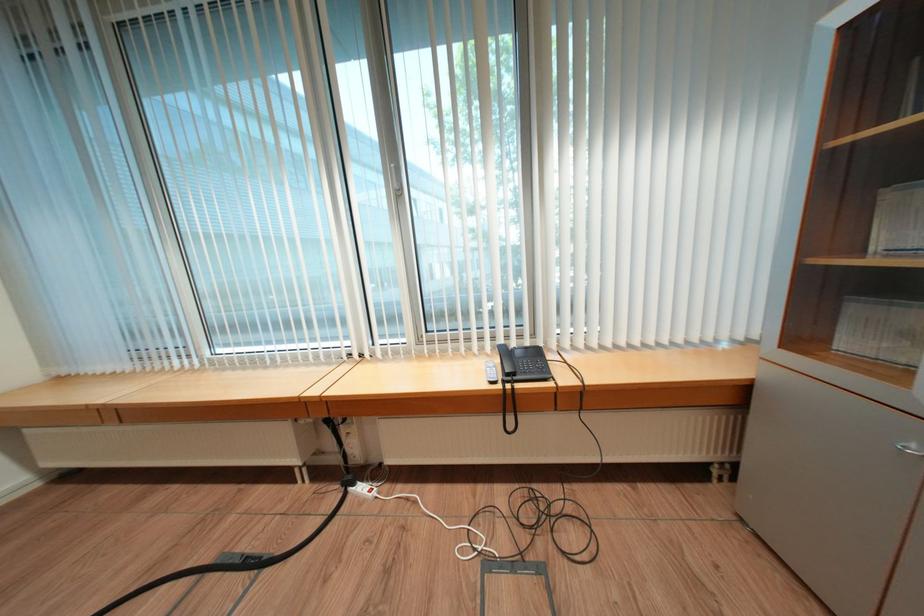
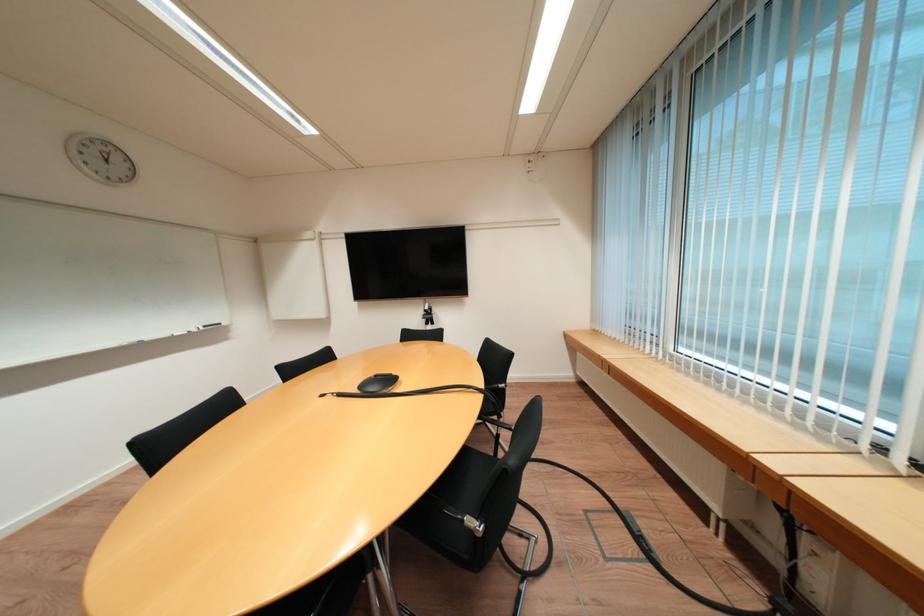
Question: The camera is either moving clockwise (left) or counter-clockwise (right) around the object. The first image is from the beginning of the video and the second image is from the end. Is the camera moving left or right when shooting the video?

Choices:
 (A) Left
 (B) Right

Answer: (B)